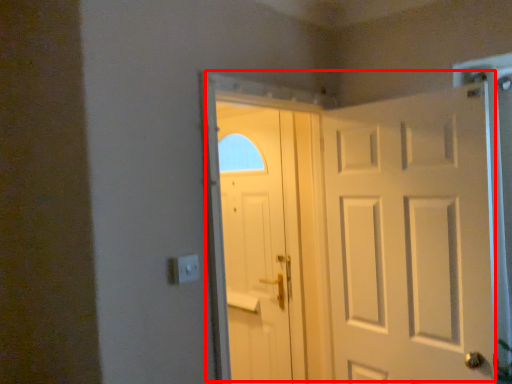
Question: From the image's perspective, where is door (annotated by the red box) located in relation to door in the image?

Choices:
 (A) above
 (B) below

Answer: (A)